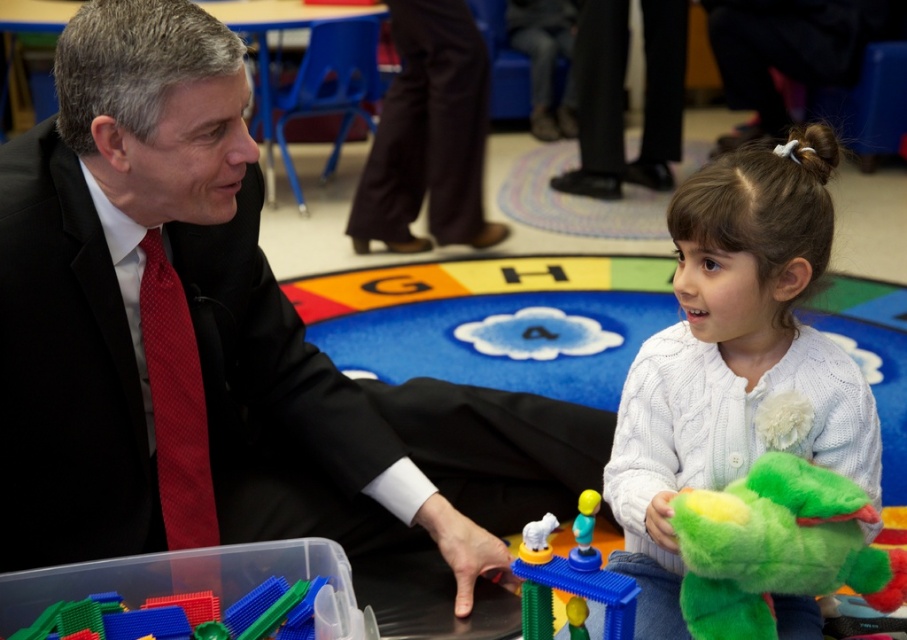
You are a tailor measuring the width of objects in the image. The smooth black suit at center and the translucent plastic building block at center are both on a table. Which object has a larger width?

The smooth black suit at center might be wider than translucent plastic building block at center.

You are a student in the classroom. You see the smooth black suit at center and the translucent plastic building block at center. Which object takes up more space in the image?

The smooth black suit at center is bigger than the translucent plastic building block at center, so it takes up more space in the image.